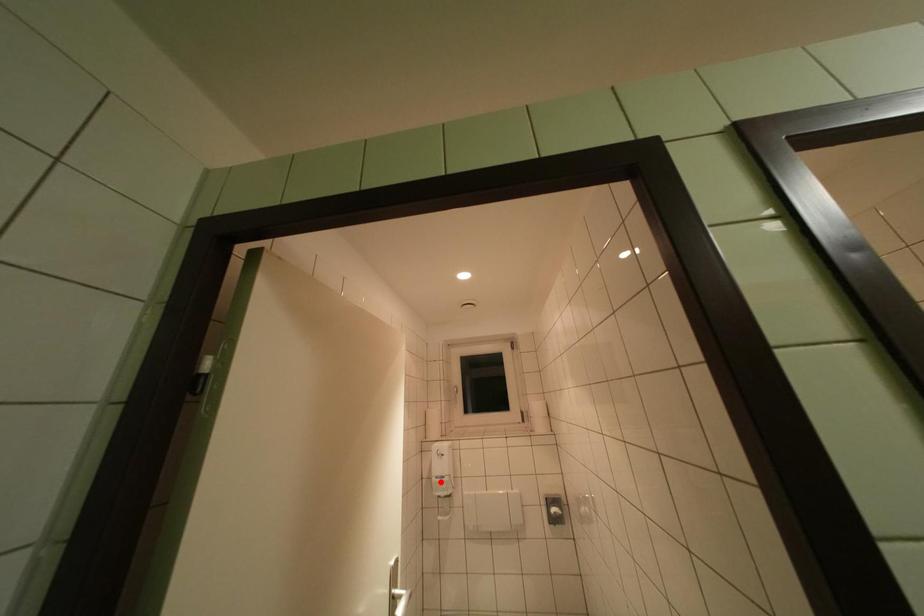
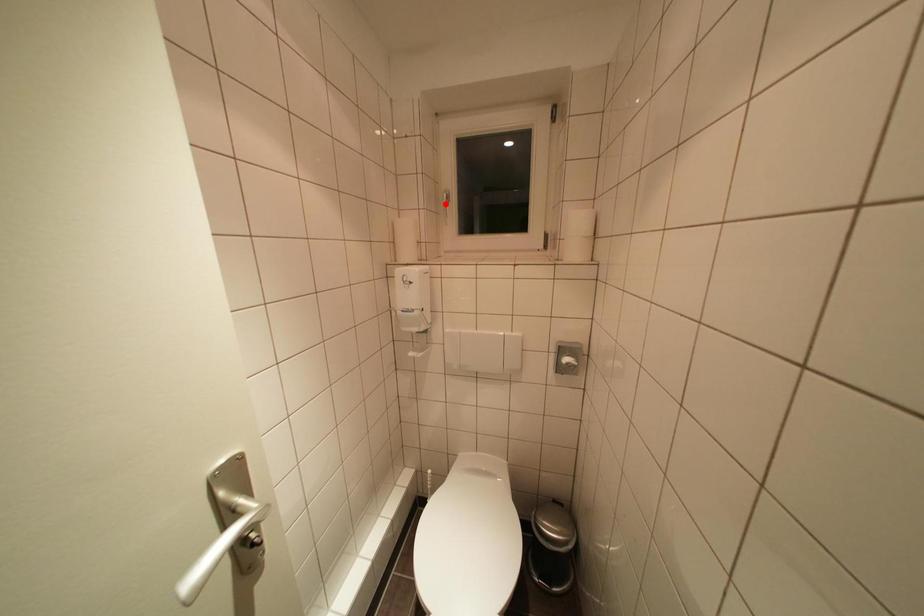
I am providing you with two images of the same scene from different viewpoints. A red point is marked on the first image and another point is marked on the second image. Are the points marked in image1 and image2 representing the same 3D position?

No